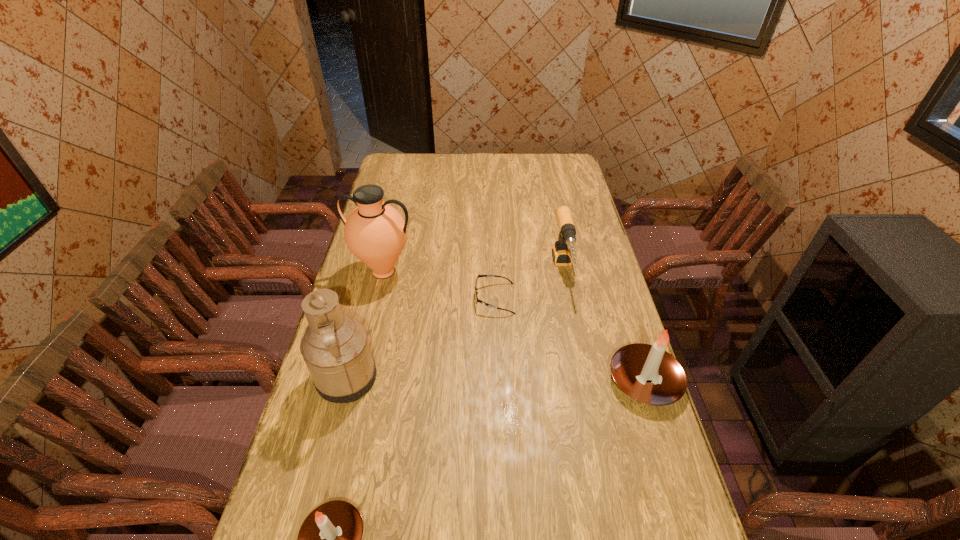
To achieve even spacing by inserting another candle among them, please point to a vacant spot for this new candle. Please provide its 2D coordinates. Your answer should be formatted as a tuple, i.e. [(x, y)], where the tuple contains the x and y coordinates of a point satisfying the conditions above.

[(510, 449)]